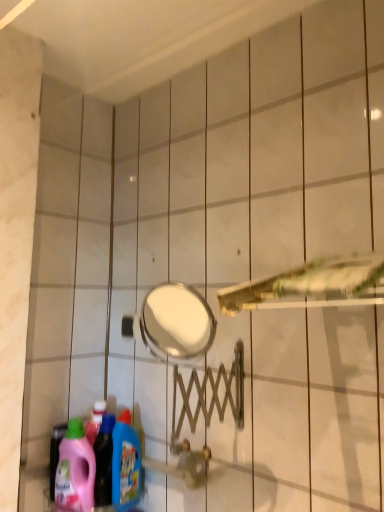
I want to click on pink plastic detergent at lower left, the first cleaning product in the left-to-right sequence, so click(x=75, y=470).

The height and width of the screenshot is (512, 384). I want to click on pink plastic detergent at lower left, which is the 2th cleaning product from right to left, so click(75, 470).

Who is bigger, metallic gold shower head at center or blue glossy detergent at lower left, the second cleaning product viewed from the left?

With larger size is metallic gold shower head at center.

Is metallic gold shower head at center at the left side of blue glossy detergent at lower left, arranged as the first cleaning product when viewed from the right?

Incorrect, metallic gold shower head at center is not on the left side of blue glossy detergent at lower left, arranged as the first cleaning product when viewed from the right.

Is metallic gold shower head at center oriented away from blue glossy detergent at lower left, the second cleaning product viewed from the left?

No, blue glossy detergent at lower left, the second cleaning product viewed from the left, is not at the back of metallic gold shower head at center.

Based on their positions, is metallic gold shower head at center located to the left or right of pink plastic detergent at lower left, the first cleaning product in the left-to-right sequence?

metallic gold shower head at center is to the right of pink plastic detergent at lower left, the first cleaning product in the left-to-right sequence.

Locate an element on the screen. The height and width of the screenshot is (512, 384). the 2nd cleaning product below the metallic gold shower head at center (from the image's perspective) is located at coordinates (75, 470).

Does metallic gold shower head at center have a lesser height compared to pink plastic detergent at lower left, the first cleaning product in the left-to-right sequence?

Indeed, metallic gold shower head at center has a lesser height compared to pink plastic detergent at lower left, the first cleaning product in the left-to-right sequence.

Who is smaller, metallic gold shower head at center or pink plastic detergent at lower left, which is the 2th cleaning product from right to left?

Smaller between the two is pink plastic detergent at lower left, which is the 2th cleaning product from right to left.

Is blue glossy detergent at lower left, the second cleaning product viewed from the left, behind metallic gold shower head at center?

Yes, it is behind metallic gold shower head at center.

From the image's perspective, who appears lower, blue glossy detergent at lower left, the second cleaning product viewed from the left, or metallic gold shower head at center?

blue glossy detergent at lower left, the second cleaning product viewed from the left, appears lower in the image.

What's the angular difference between blue glossy detergent at lower left, the second cleaning product viewed from the left, and metallic gold shower head at center's facing directions?

The angular difference between blue glossy detergent at lower left, the second cleaning product viewed from the left, and metallic gold shower head at center is 89.3 degrees.

Image resolution: width=384 pixels, height=512 pixels. Find the location of `cleaning product behind the pink plastic detergent at lower left, which is the 2th cleaning product from right to left`. cleaning product behind the pink plastic detergent at lower left, which is the 2th cleaning product from right to left is located at coordinates (125, 464).

From the picture: Who is more distant, blue glossy detergent at lower left, arranged as the first cleaning product when viewed from the right, or pink plastic detergent at lower left, the first cleaning product in the left-to-right sequence?

blue glossy detergent at lower left, arranged as the first cleaning product when viewed from the right, is more distant.

From the picture: Is blue glossy detergent at lower left, the second cleaning product viewed from the left, aimed at pink plastic detergent at lower left, the first cleaning product in the left-to-right sequence?

No, blue glossy detergent at lower left, the second cleaning product viewed from the left, is not turned towards pink plastic detergent at lower left, the first cleaning product in the left-to-right sequence.

Can you confirm if blue glossy detergent at lower left, arranged as the first cleaning product when viewed from the right, is bigger than pink plastic detergent at lower left, the first cleaning product in the left-to-right sequence?

Incorrect, blue glossy detergent at lower left, arranged as the first cleaning product when viewed from the right, is not larger than pink plastic detergent at lower left, the first cleaning product in the left-to-right sequence.

From the image's perspective, which one is positioned higher, pink plastic detergent at lower left, the first cleaning product in the left-to-right sequence, or metallic gold shower head at center?

metallic gold shower head at center.

From a real-world perspective, between pink plastic detergent at lower left, which is the 2th cleaning product from right to left, and metallic gold shower head at center, who is vertically higher?

metallic gold shower head at center, from a real-world perspective.

In the scene shown: Between pink plastic detergent at lower left, which is the 2th cleaning product from right to left, and metallic gold shower head at center, which one has less height?

metallic gold shower head at center.

Is pink plastic detergent at lower left, the first cleaning product in the left-to-right sequence, positioned behind metallic gold shower head at center?

Yes, the depth of pink plastic detergent at lower left, the first cleaning product in the left-to-right sequence, is greater than that of metallic gold shower head at center.

Who is taller, pink plastic detergent at lower left, which is the 2th cleaning product from right to left, or blue glossy detergent at lower left, arranged as the first cleaning product when viewed from the right?

blue glossy detergent at lower left, arranged as the first cleaning product when viewed from the right.

Image resolution: width=384 pixels, height=512 pixels. In order to click on cleaning product that is on the left side of blue glossy detergent at lower left, the second cleaning product viewed from the left in this screenshot , I will do `click(75, 470)`.

From the image's perspective, is pink plastic detergent at lower left, which is the 2th cleaning product from right to left, beneath blue glossy detergent at lower left, the second cleaning product viewed from the left?

Yes, from the image's perspective, pink plastic detergent at lower left, which is the 2th cleaning product from right to left, is below blue glossy detergent at lower left, the second cleaning product viewed from the left.

Is pink plastic detergent at lower left, which is the 2th cleaning product from right to left, looking in the opposite direction of blue glossy detergent at lower left, arranged as the first cleaning product when viewed from the right?

No, pink plastic detergent at lower left, which is the 2th cleaning product from right to left, is not facing the opposite direction of blue glossy detergent at lower left, arranged as the first cleaning product when viewed from the right.

Where is `the 1st cleaning product positioned below the metallic gold shower head at center (from a real-world perspective)`? Image resolution: width=384 pixels, height=512 pixels. the 1st cleaning product positioned below the metallic gold shower head at center (from a real-world perspective) is located at coordinates (125, 464).

Where is `the 2nd cleaning product to the left of the metallic gold shower head at center, counting from the anchor's position`? This screenshot has height=512, width=384. the 2nd cleaning product to the left of the metallic gold shower head at center, counting from the anchor's position is located at coordinates (75, 470).

Based on their spatial positions, is blue glossy detergent at lower left, arranged as the first cleaning product when viewed from the right, or metallic gold shower head at center further from pink plastic detergent at lower left, the first cleaning product in the left-to-right sequence?

metallic gold shower head at center is positioned further to the anchor pink plastic detergent at lower left, the first cleaning product in the left-to-right sequence.

Which object lies nearer to the anchor point metallic gold shower head at center, pink plastic detergent at lower left, which is the 2th cleaning product from right to left, or blue glossy detergent at lower left, arranged as the first cleaning product when viewed from the right?

blue glossy detergent at lower left, arranged as the first cleaning product when viewed from the right, lies closer to metallic gold shower head at center than the other object.

Estimate the real-world distances between objects in this image. Which object is further from blue glossy detergent at lower left, arranged as the first cleaning product when viewed from the right, metallic gold shower head at center or pink plastic detergent at lower left, which is the 2th cleaning product from right to left?

Based on the image, metallic gold shower head at center appears to be further to blue glossy detergent at lower left, arranged as the first cleaning product when viewed from the right.

From the image, which object appears to be farther from pink plastic detergent at lower left, which is the 2th cleaning product from right to left, metallic gold shower head at center or blue glossy detergent at lower left, arranged as the first cleaning product when viewed from the right?

metallic gold shower head at center.

Looking at the image, which one is located closer to metallic gold shower head at center, blue glossy detergent at lower left, the second cleaning product viewed from the left, or pink plastic detergent at lower left, the first cleaning product in the left-to-right sequence?

The object closer to metallic gold shower head at center is blue glossy detergent at lower left, the second cleaning product viewed from the left.

From the picture: From the image, which object appears to be farther from blue glossy detergent at lower left, arranged as the first cleaning product when viewed from the right, pink plastic detergent at lower left, which is the 2th cleaning product from right to left, or metallic gold shower head at center?

The object further to blue glossy detergent at lower left, arranged as the first cleaning product when viewed from the right, is metallic gold shower head at center.

Find the location of a particular element. The image size is (384, 512). cleaning product between metallic gold shower head at center and blue glossy detergent at lower left, the second cleaning product viewed from the left, in the front-back direction is located at coordinates (75, 470).